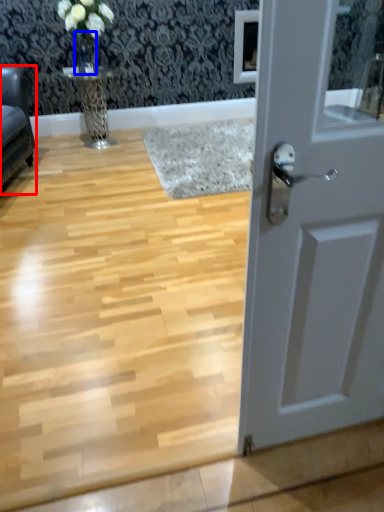
Question: Which point is closer to the camera, furniture (highlighted by a red box) or glass vase (highlighted by a blue box)?

Choices:
 (A) furniture
 (B) glass vase

Answer: (A)